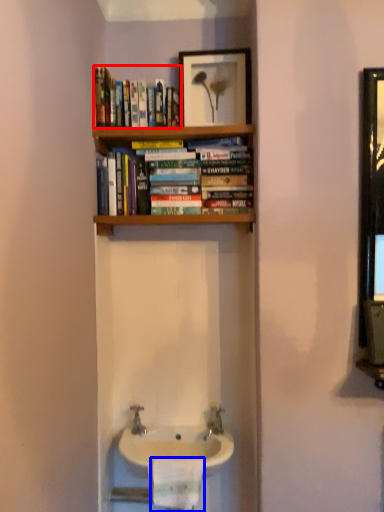
Question: Which of the following is the farthest to the observer, book (highlighted by a red box) or toilet paper (highlighted by a blue box)?

Choices:
 (A) book
 (B) toilet paper

Answer: (A)